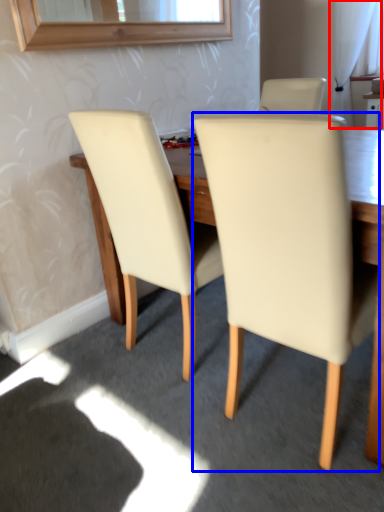
Question: Which object appears farthest to the camera in this image, curtain (highlighted by a red box) or chair (highlighted by a blue box)?

Choices:
 (A) curtain
 (B) chair

Answer: (A)